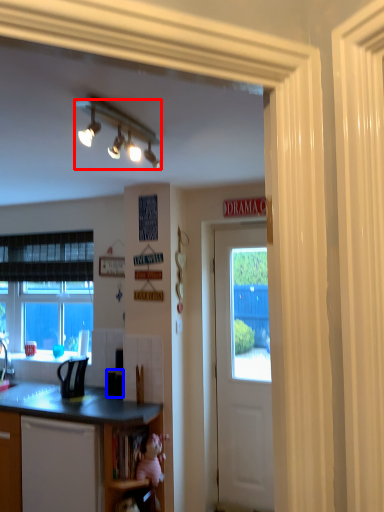
Question: Among these objects, which one is nearest to the camera, lamp (highlighted by a red box) or microwave oven (highlighted by a blue box)?

Choices:
 (A) lamp
 (B) microwave oven

Answer: (A)